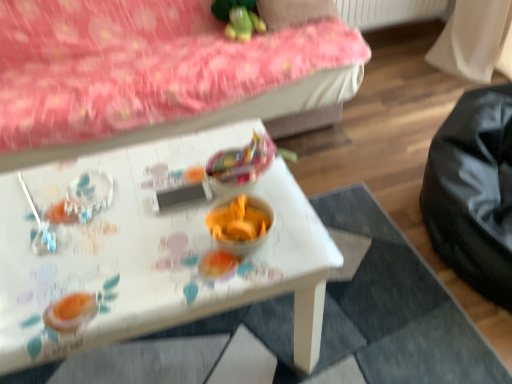
Question: From the image's perspective, is white glossy table at center above or below green plush toy at upper center?

Choices:
 (A) above
 (B) below

Answer: (B)

Question: Is white glossy table at center inside or outside of green plush toy at upper center?

Choices:
 (A) outside
 (B) inside

Answer: (A)

Question: Which object is the closest to the pink fabric bed frame at upper left?

Choices:
 (A) shiny plastic candy at center
 (B) white glossy table at center
 (C) green plush toy at upper center
 (D) pink fabric pillow at upper center

Answer: (C)

Question: Considering the real-world distances, which object is closest to the white glossy table at center?

Choices:
 (A) pink fabric bed frame at upper left
 (B) pink fabric pillow at upper center
 (C) green plush toy at upper center
 (D) shiny plastic candy at center

Answer: (D)